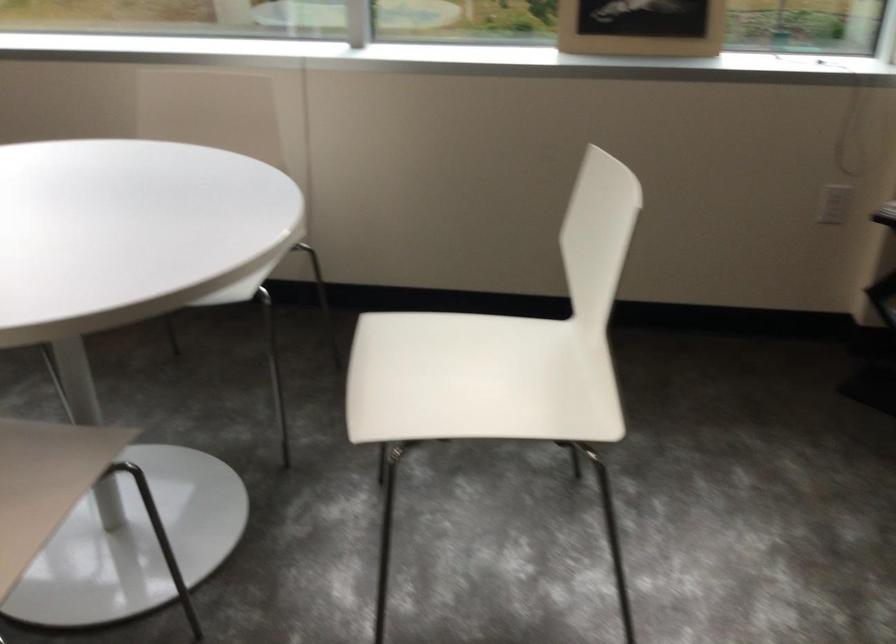
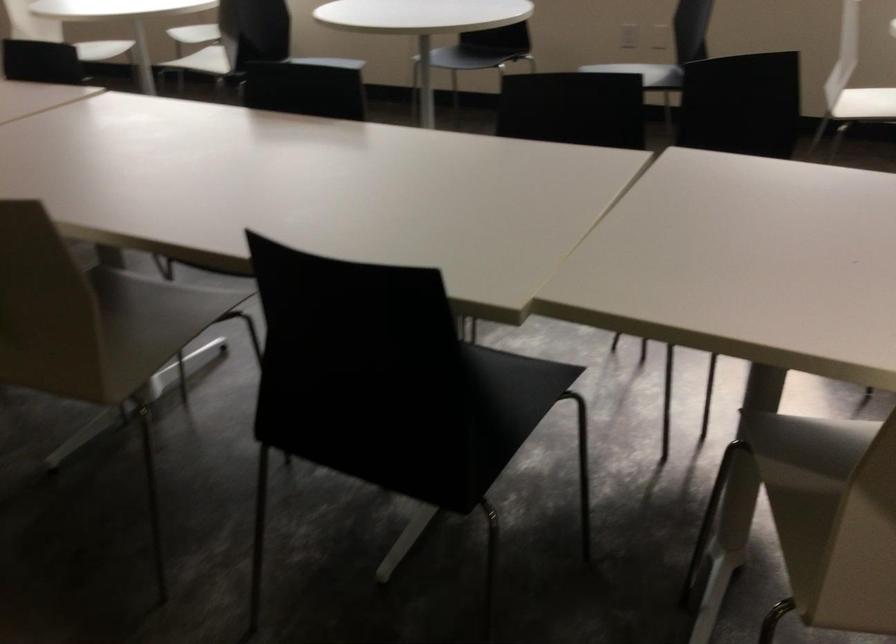
In a continuous first-person perspective shot, in which direction is the camera moving?

The cameraman walked toward left, backward.